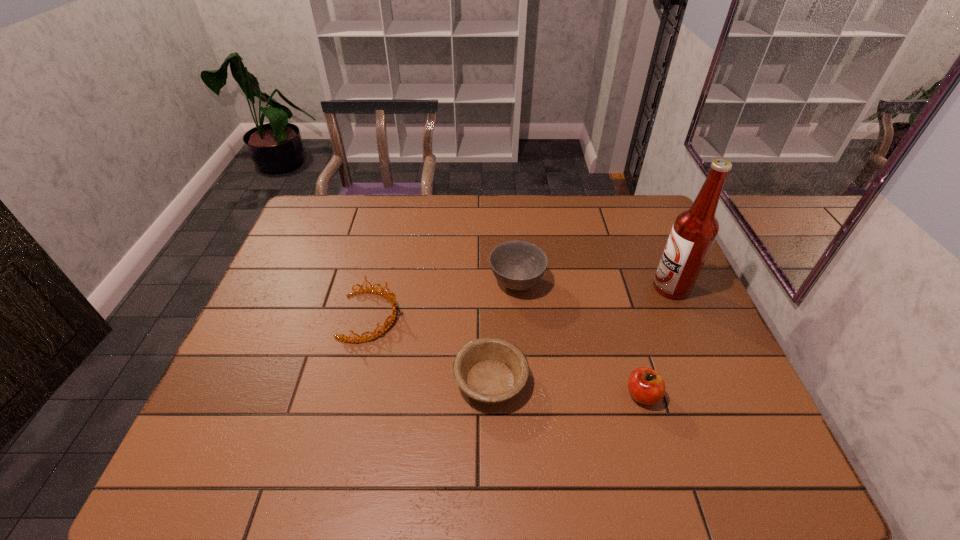
Identify the location of alcohol. Image resolution: width=960 pixels, height=540 pixels. (694, 231).

Locate an element on the screen. The image size is (960, 540). the tallest object is located at coordinates (694, 231).

This screenshot has height=540, width=960. Find the location of `the taller bowl`. the taller bowl is located at coordinates (518, 265).

I want to click on the leftmost object, so click(x=344, y=338).

Find the location of a particular element. The image size is (960, 540). apple is located at coordinates (645, 385).

Where is `the nearer bowl`? the nearer bowl is located at coordinates (490, 370).

Locate an element on the screen. This screenshot has height=540, width=960. the shortest object is located at coordinates (490, 370).

I want to click on vacant position located 0.100m on the label side of the rightmost object, so click(x=619, y=287).

Where is `vacant space located on the label side of the rightmost object`? vacant space located on the label side of the rightmost object is located at coordinates (615, 287).

Where is `vacant space located on the label side of the rightmost object`? Image resolution: width=960 pixels, height=540 pixels. vacant space located on the label side of the rightmost object is located at coordinates (520, 287).